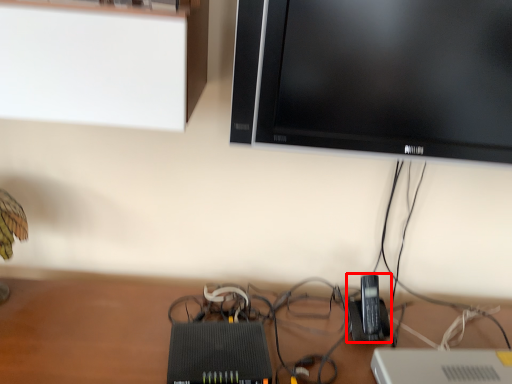
Question: From the image's perspective, considering the relative positions of gadget (annotated by the red box) and television in the image provided, where is gadget (annotated by the red box) located with respect to the staircase?

Choices:
 (A) below
 (B) above

Answer: (A)